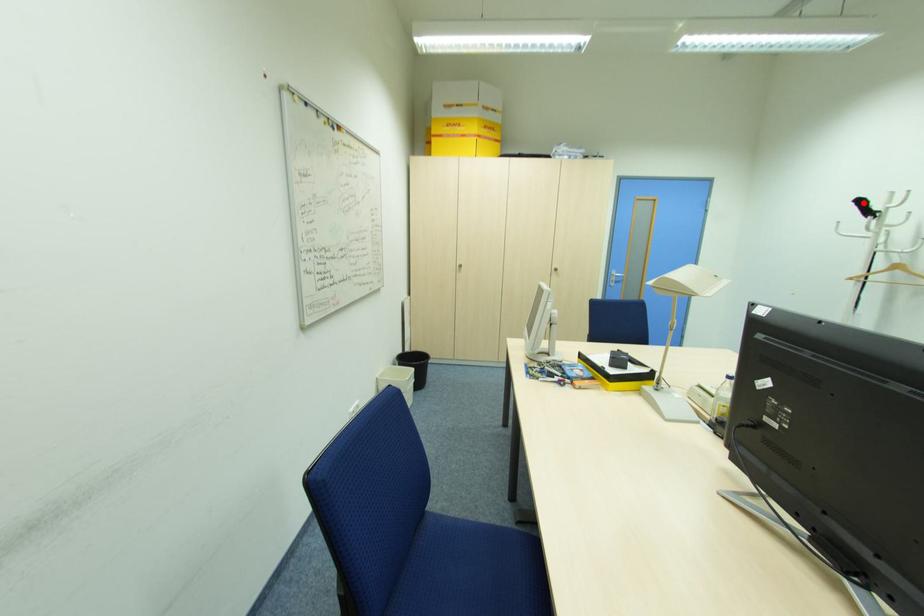
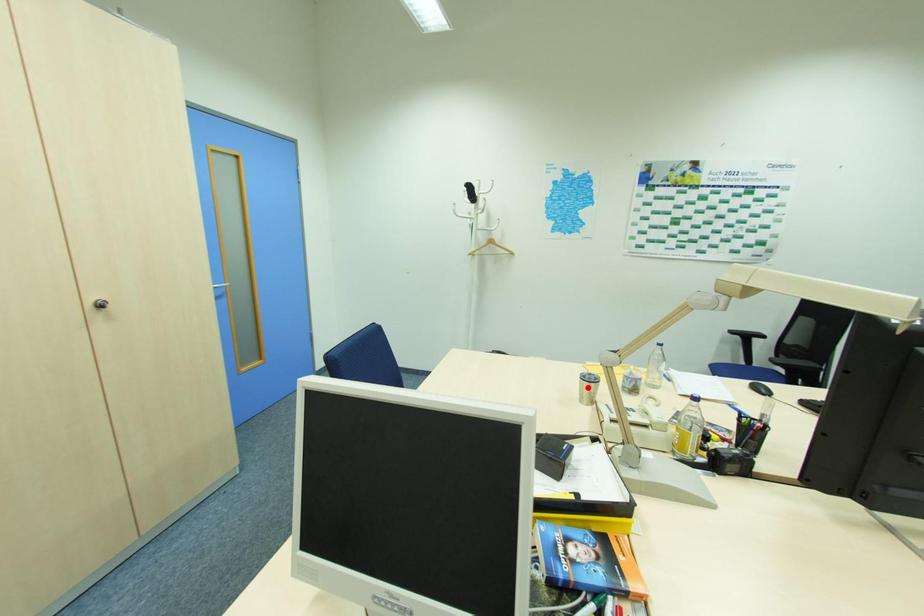
I am providing you with two images of the same scene from different viewpoints. A red point is marked on the first image and another point is marked on the second image. Is the marked point in image1 the same physical position as the marked point in image2?

No